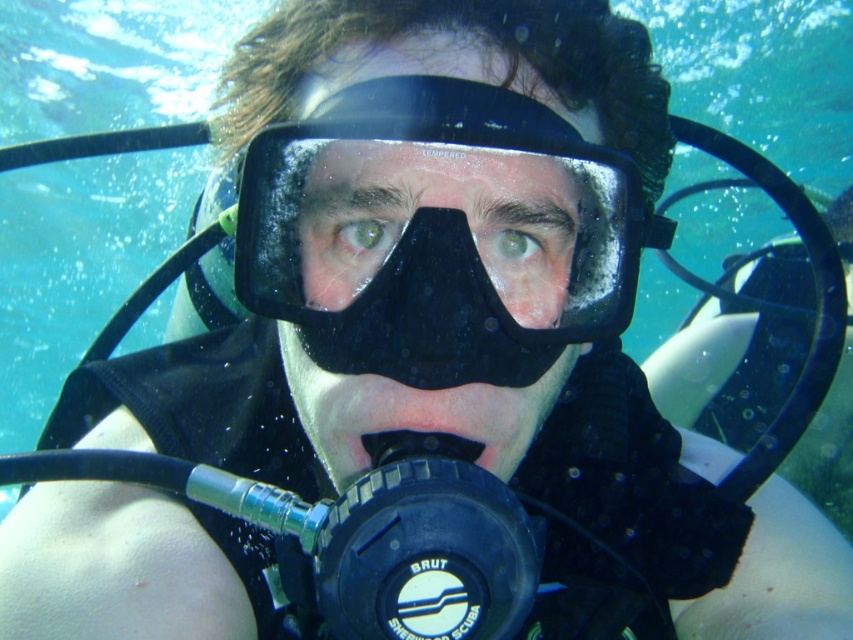
Question: Which of these objects is positioned closest to the matte black nose at center?

Choices:
 (A) black matte scuba mask at center
 (B) black rubber mouthpiece at center

Answer: (A)

Question: Does matte black nose at center have a smaller size compared to black rubber mouthpiece at center?

Choices:
 (A) no
 (B) yes

Answer: (A)

Question: Is matte black nose at center positioned at the back of black rubber mouthpiece at center?

Choices:
 (A) no
 (B) yes

Answer: (B)

Question: Which object is positioned farthest from the black rubber mouthpiece at center?

Choices:
 (A) matte black nose at center
 (B) black matte scuba mask at center

Answer: (B)

Question: Is matte black nose at center closer to the viewer compared to black rubber mouthpiece at center?

Choices:
 (A) no
 (B) yes

Answer: (A)

Question: Which point is farther to the camera?

Choices:
 (A) (556, 316)
 (B) (448, 224)

Answer: (A)